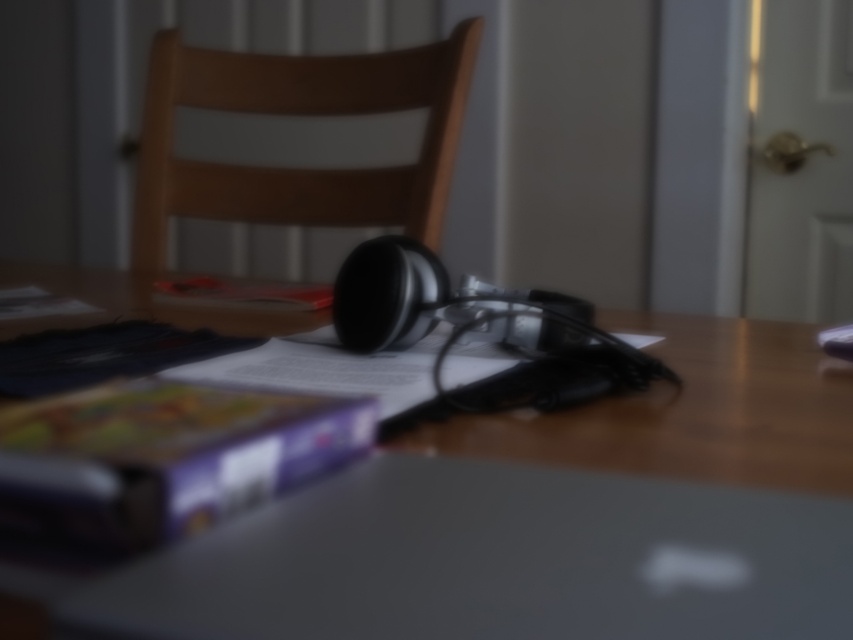
Is the position of wooden table at center less distant than that of wooden chair at center?

Yes.

Can you confirm if wooden table at center is thinner than wooden chair at center?

Yes.

Measure the distance between wooden table at center and camera.

5.90 inches

Identify the location of wooden table at center. The width and height of the screenshot is (853, 640). (534, 516).

Between sleek matte laptop at center and wooden chair at center, which one has less height?

sleek matte laptop at center

This screenshot has width=853, height=640. What do you see at coordinates (492, 561) in the screenshot?
I see `sleek matte laptop at center` at bounding box center [492, 561].

Which is behind, point (410, 538) or point (149, 132)?

Positioned behind is point (149, 132).

This screenshot has height=640, width=853. What are the coordinates of `sleek matte laptop at center` in the screenshot? It's located at (492, 561).

Between wooden table at center and sleek matte laptop at center, which one appears on the right side from the viewer's perspective?

Positioned to the right is wooden table at center.

Find the location of a particular element. The width and height of the screenshot is (853, 640). wooden table at center is located at coordinates click(534, 516).

Does point (788, 486) come closer to viewer compared to point (822, 550)?

No, (788, 486) is further to viewer.

I want to click on wooden table at center, so click(x=534, y=516).